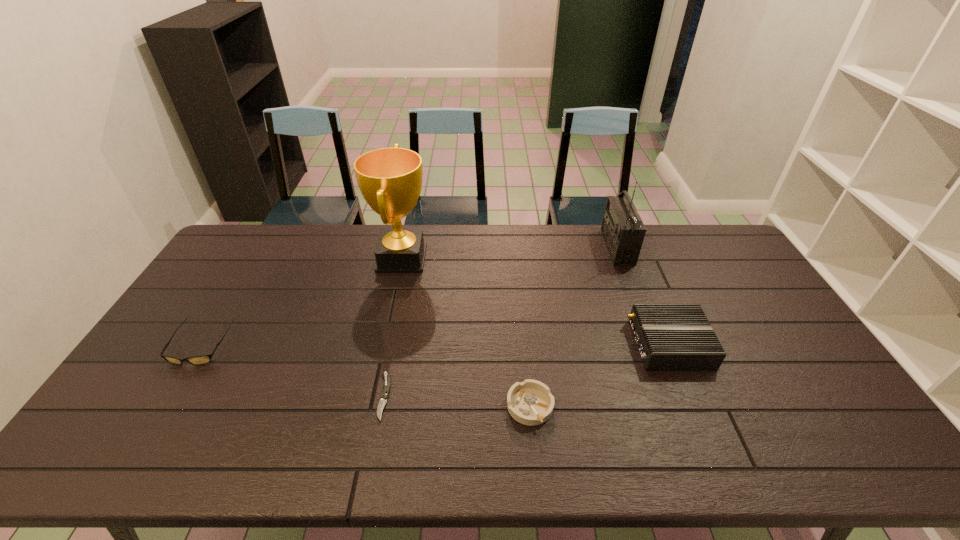
Identify the location of award. The height and width of the screenshot is (540, 960). (390, 179).

Identify the location of radio receiver. (623, 230).

At what (x,y) coordinates should I click in order to perform the action: click on the fourth shortest object. Please return your answer as a coordinate pair (x, y). The image size is (960, 540). Looking at the image, I should click on (670, 337).

At what (x,y) coordinates should I click in order to perform the action: click on sunglasses. Please return your answer as a coordinate pair (x, y). The width and height of the screenshot is (960, 540). Looking at the image, I should click on (199, 359).

At what (x,y) coordinates should I click in order to perform the action: click on the leftmost object. Please return your answer as a coordinate pair (x, y). The width and height of the screenshot is (960, 540). Looking at the image, I should click on (199, 359).

Locate an element on the screen. The height and width of the screenshot is (540, 960). the third object from right to left is located at coordinates (530, 402).

I want to click on the second shortest object, so click(x=530, y=402).

You are a GUI agent. You are given a task and a screenshot of the screen. Output one action in this format:
    pyautogui.click(x=<x>, y=<y>)
    Task: Click on the shortest object
    Image resolution: width=960 pixels, height=540 pixels.
    Given the screenshot: What is the action you would take?
    pyautogui.click(x=387, y=384)

At what (x,y) coordinates should I click in order to perform the action: click on free space located 0.110m on the front-facing side of the award. Please return your answer as a coordinate pair (x, y). This screenshot has height=540, width=960. Looking at the image, I should click on (461, 258).

Locate an element on the screen. The width and height of the screenshot is (960, 540). vacant space located on the front panel of the radio receiver is located at coordinates (589, 247).